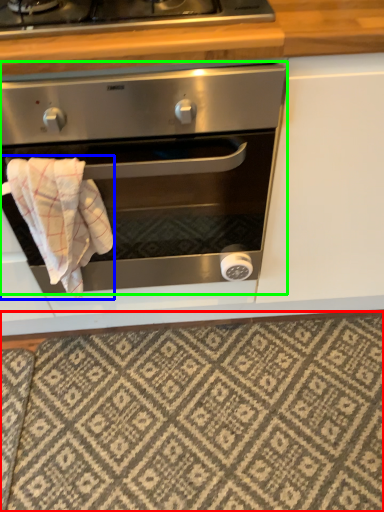
Question: Estimate the real-world distances between objects in this image. Which object is closer to tile (highlighted by a red box), bath towel (highlighted by a blue box) or oven (highlighted by a green box)?

Choices:
 (A) bath towel
 (B) oven

Answer: (B)